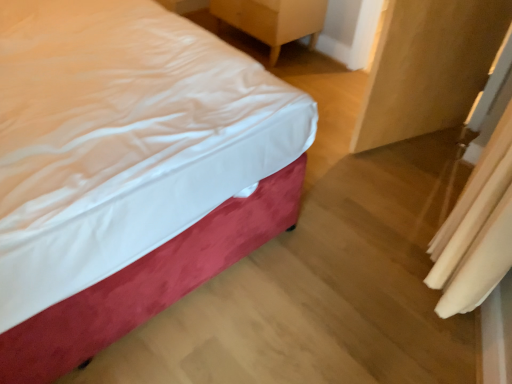
Question: From the image's perspective, is wooden nightstand at upper right on top of velvet-like red bed at left?

Choices:
 (A) yes
 (B) no

Answer: (A)

Question: Considering the relative sizes of wooden nightstand at upper right and velvet-like red bed at left in the image provided, is wooden nightstand at upper right taller than velvet-like red bed at left?

Choices:
 (A) no
 (B) yes

Answer: (A)

Question: Is the depth of wooden nightstand at upper right greater than that of velvet-like red bed at left?

Choices:
 (A) yes
 (B) no

Answer: (A)

Question: Would you say wooden nightstand at upper right contains velvet-like red bed at left?

Choices:
 (A) yes
 (B) no

Answer: (B)

Question: From a real-world perspective, is wooden nightstand at upper right located beneath velvet-like red bed at left?

Choices:
 (A) no
 (B) yes

Answer: (B)

Question: Looking at the image, does velvet-like red bed at left seem bigger or smaller compared to matte wood armoire at right?

Choices:
 (A) small
 (B) big

Answer: (B)

Question: Considering the relative positions of velvet-like red bed at left and matte wood armoire at right in the image provided, is velvet-like red bed at left to the left or to the right of matte wood armoire at right?

Choices:
 (A) right
 (B) left

Answer: (B)

Question: From their relative heights in the image, would you say velvet-like red bed at left is taller or shorter than matte wood armoire at right?

Choices:
 (A) tall
 (B) short

Answer: (B)

Question: Do you think velvet-like red bed at left is within matte wood armoire at right, or outside of it?

Choices:
 (A) outside
 (B) inside

Answer: (A)

Question: From a real-world perspective, is matte wood armoire at right physically located above or below wooden nightstand at upper right?

Choices:
 (A) above
 (B) below

Answer: (A)

Question: Considering the positions of matte wood armoire at right and wooden nightstand at upper right in the image, is matte wood armoire at right bigger or smaller than wooden nightstand at upper right?

Choices:
 (A) big
 (B) small

Answer: (B)

Question: Relative to wooden nightstand at upper right, is matte wood armoire at right in front or behind?

Choices:
 (A) front
 (B) behind

Answer: (A)

Question: Considering the positions of matte wood armoire at right and wooden nightstand at upper right in the image, is matte wood armoire at right wider or thinner than wooden nightstand at upper right?

Choices:
 (A) wide
 (B) thin

Answer: (B)

Question: Is white fabric curtain at lower right in front of or behind velvet-like red bed at left in the image?

Choices:
 (A) behind
 (B) front

Answer: (A)

Question: From a real-world perspective, is white fabric curtain at lower right positioned above or below velvet-like red bed at left?

Choices:
 (A) below
 (B) above

Answer: (B)